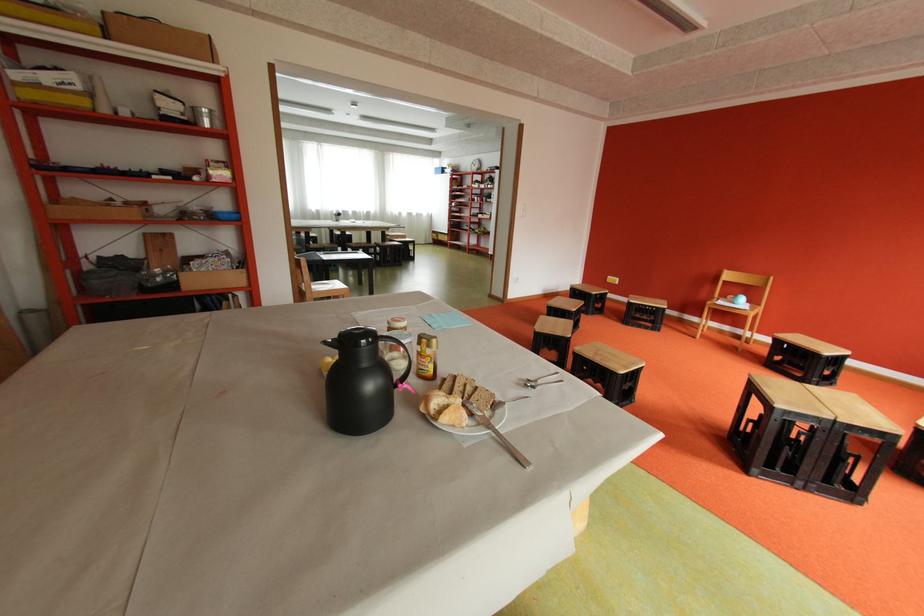
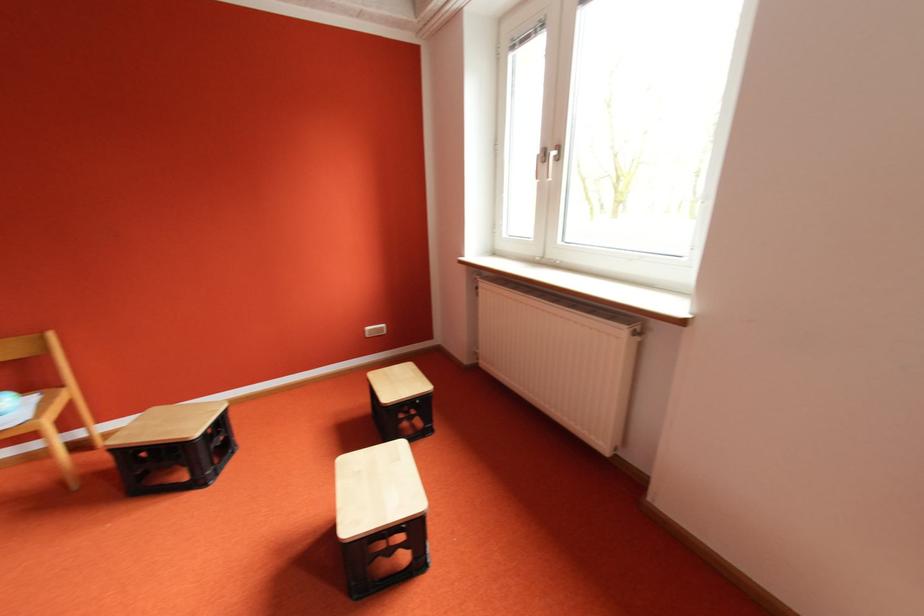
Find the pixel in the second image that matches (x=745, y=302) in the first image.

(5, 413)